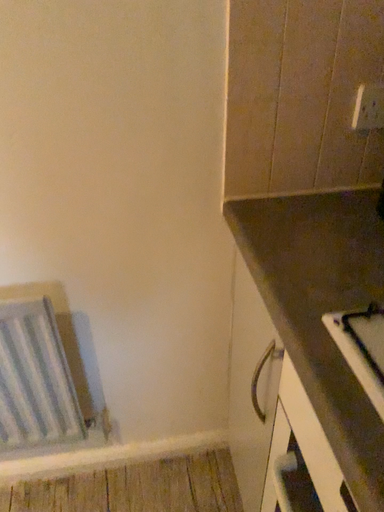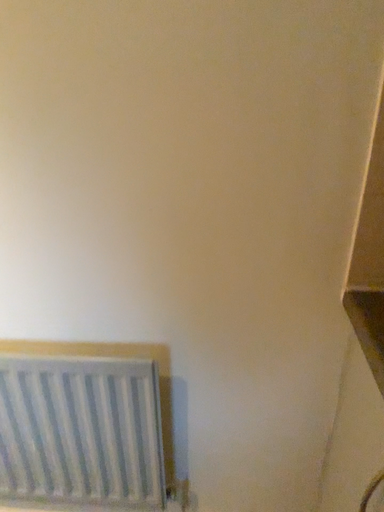
Question: Which way did the camera rotate in the video?

Choices:
 (A) rotated right
 (B) rotated left

Answer: (B)